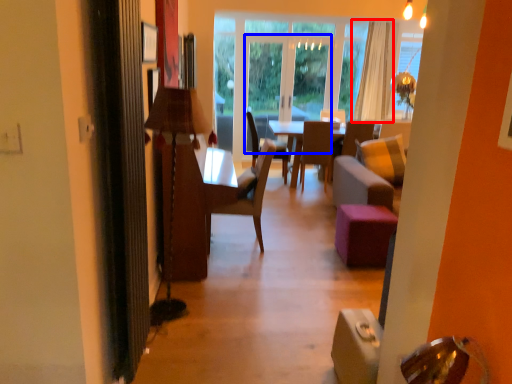
Question: Which object appears closest to the camera in this image, curtain (highlighted by a red box) or glass door (highlighted by a blue box)?

Choices:
 (A) curtain
 (B) glass door

Answer: (A)